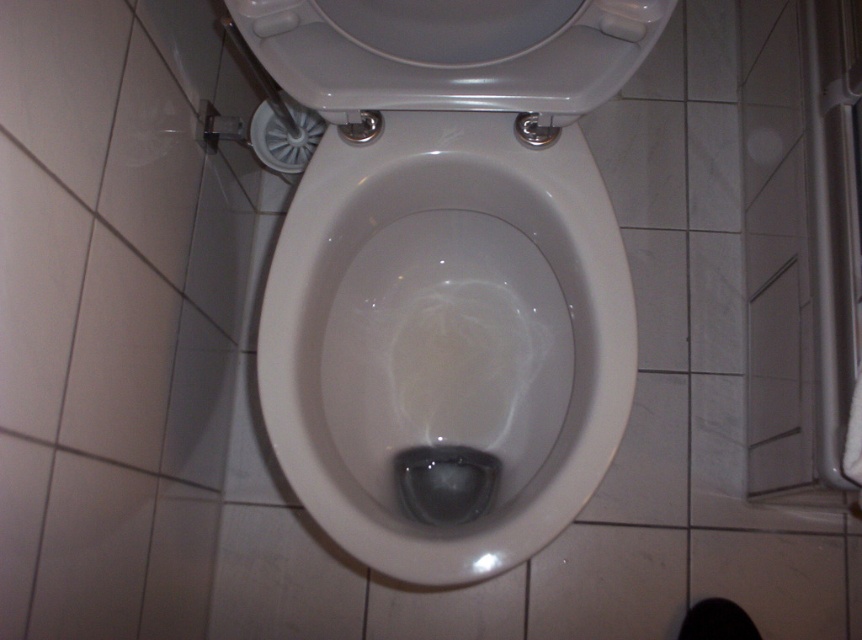
You are a cleaning robot in a bathroom. You need to clean the white glossy toilet bowl at center and the white glossy tile at lower center. Which one should you clean first if you want to start from the higher position?

The white glossy toilet bowl at center is above the white glossy tile at lower center, so you should clean the white glossy toilet bowl at center first.

You are a cleaning robot in a bathroom. You need to clean the white glossy toilet bowl at center. Where should you move to in order to reach it?

The white glossy toilet bowl at center is located at point (442, 332), so you should move towards that coordinate to reach it.